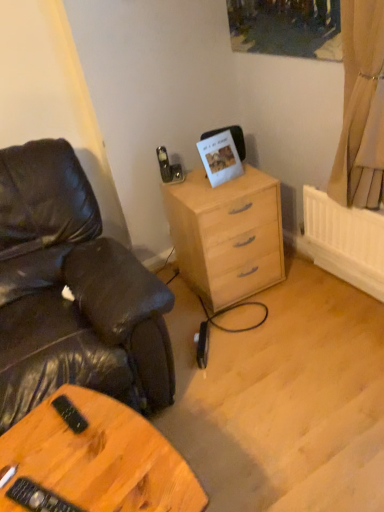
Question: Is wooden table at lower left next to beige fabric curtain at upper right and touching it?

Choices:
 (A) yes
 (B) no

Answer: (B)

Question: Is beige fabric curtain at upper right surrounded by wooden table at lower left?

Choices:
 (A) no
 (B) yes

Answer: (A)

Question: Is wooden table at lower left bigger than beige fabric curtain at upper right?

Choices:
 (A) yes
 (B) no

Answer: (A)

Question: Is wooden table at lower left taller than beige fabric curtain at upper right?

Choices:
 (A) no
 (B) yes

Answer: (A)

Question: Is wooden table at lower left positioned with its back to beige fabric curtain at upper right?

Choices:
 (A) yes
 (B) no

Answer: (B)

Question: From the image's perspective, would you say wooden table at lower left is shown under beige fabric curtain at upper right?

Choices:
 (A) no
 (B) yes

Answer: (B)

Question: Is light wood/finish chest of drawers at center positioned far away from beige fabric curtain at upper right?

Choices:
 (A) yes
 (B) no

Answer: (B)

Question: Considering the relative sizes of light wood/finish chest of drawers at center and beige fabric curtain at upper right in the image provided, is light wood/finish chest of drawers at center smaller than beige fabric curtain at upper right?

Choices:
 (A) yes
 (B) no

Answer: (B)

Question: Can you confirm if light wood/finish chest of drawers at center is shorter than beige fabric curtain at upper right?

Choices:
 (A) yes
 (B) no

Answer: (A)

Question: Can you confirm if light wood/finish chest of drawers at center is bigger than beige fabric curtain at upper right?

Choices:
 (A) no
 (B) yes

Answer: (B)

Question: Can you confirm if light wood/finish chest of drawers at center is thinner than beige fabric curtain at upper right?

Choices:
 (A) no
 (B) yes

Answer: (A)

Question: Is light wood/finish chest of drawers at center not inside beige fabric curtain at upper right?

Choices:
 (A) yes
 (B) no

Answer: (A)

Question: Does black leather chair at left lie behind beige fabric curtain at upper right?

Choices:
 (A) no
 (B) yes

Answer: (A)